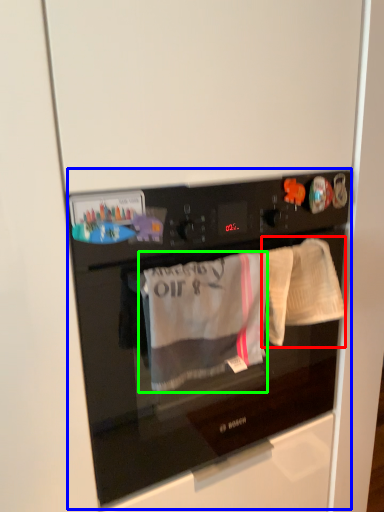
Question: Estimate the real-world distances between objects in this image. Which object is farther from baby clothe (highlighted by a red box), home appliance (highlighted by a blue box) or clothing (highlighted by a green box)?

Choices:
 (A) home appliance
 (B) clothing

Answer: (A)